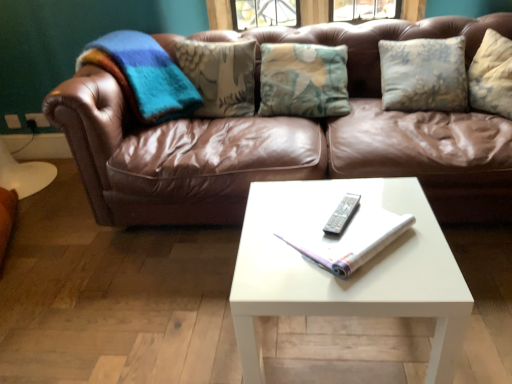
Locate an element on the screen. The image size is (512, 384). vacant space that is to the left of white glossy coffee table at center is located at coordinates (178, 320).